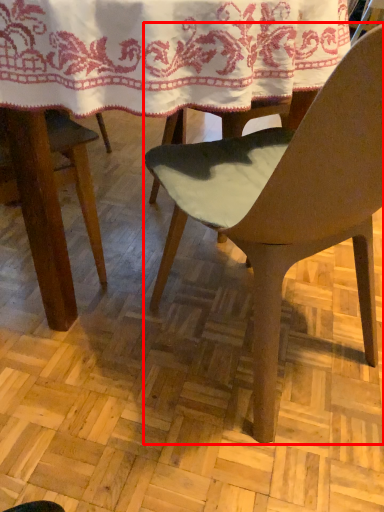
Question: From the image's perspective, considering the relative positions of chair (annotated by the red box) and blanket in the image provided, where is chair (annotated by the red box) located with respect to the staircase?

Choices:
 (A) below
 (B) above

Answer: (A)